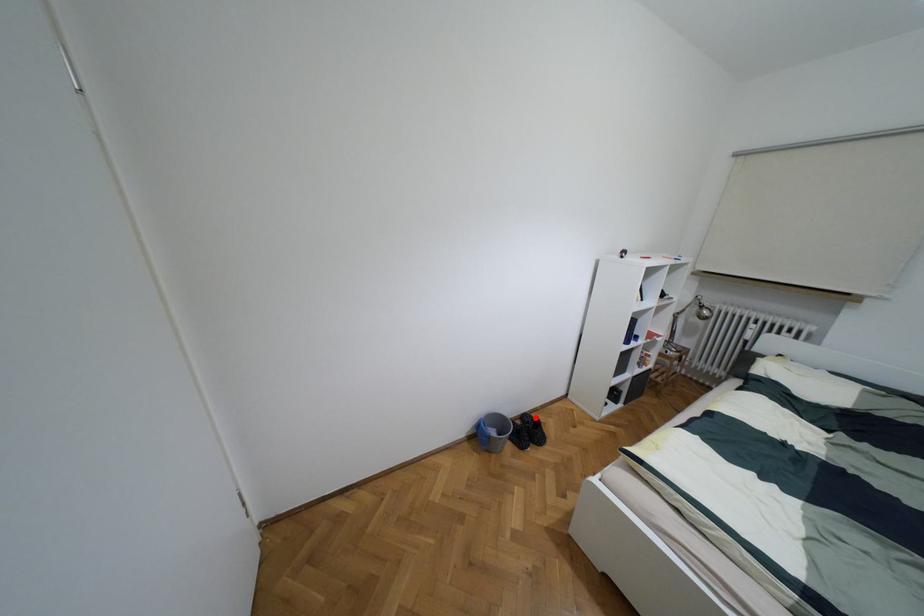
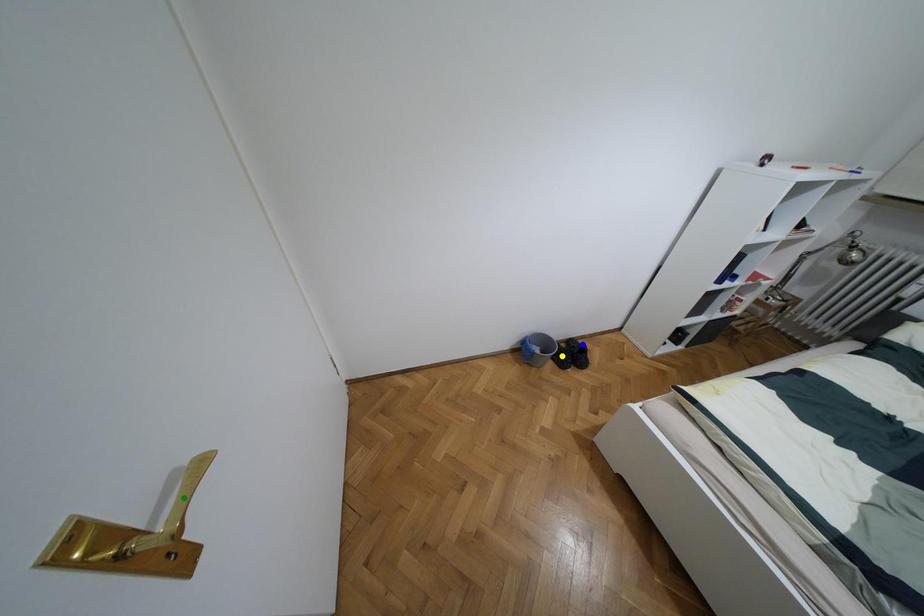
Question: I am providing you with two images of the same scene from different viewpoints. A red point is marked on the first image. You are given multiple points on the second image. Which point in image 2 represents the same 3d spot as the red point in image 1?

Choices:
 (A) blue point
 (B) green point
 (C) yellow point

Answer: (A)